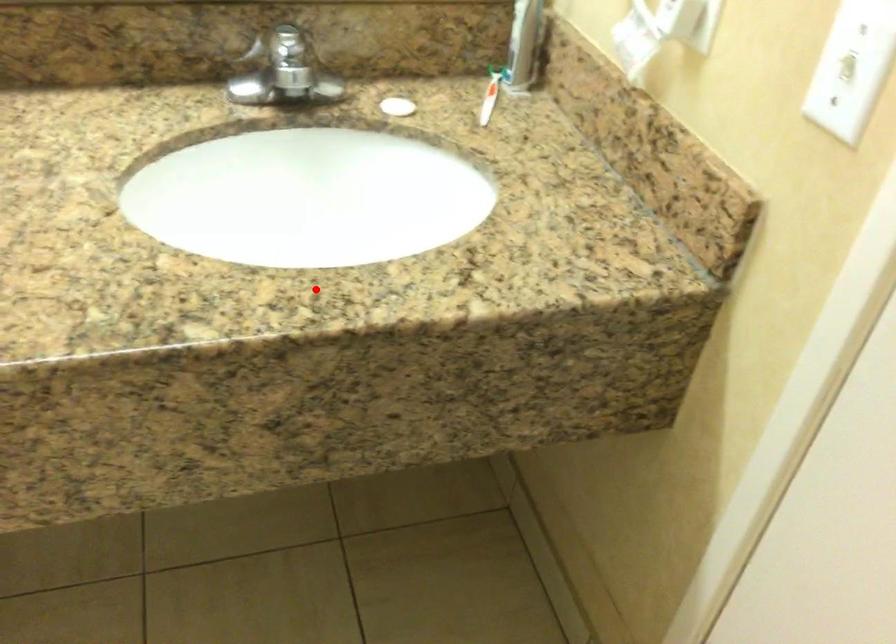
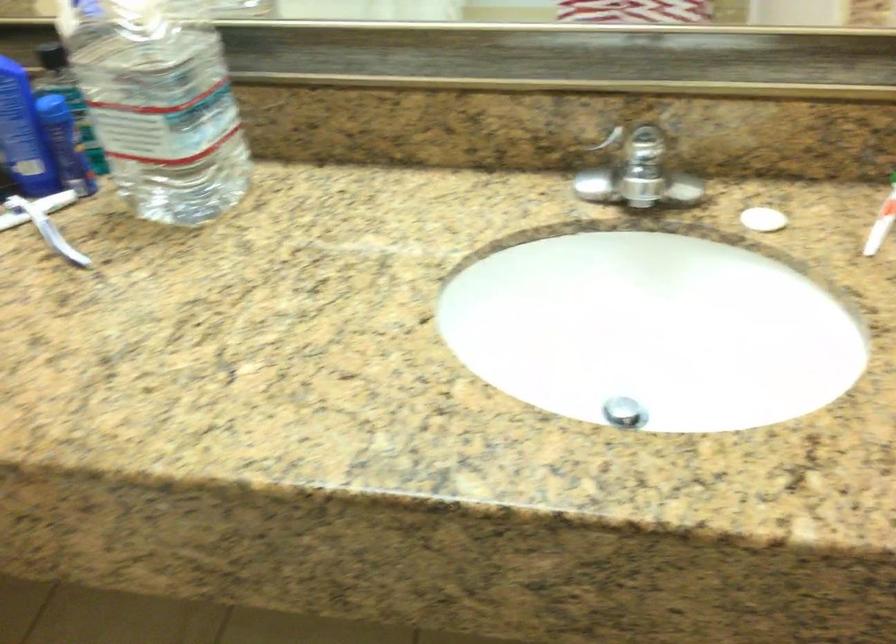
The point at the highlighted location is marked in the first image. Where is the corresponding point in the second image?

(624, 412)